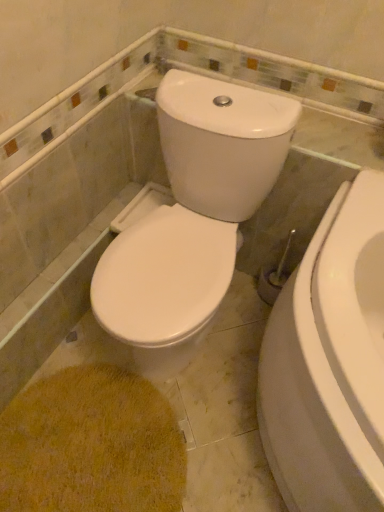
Find the location of a particular element. white glossy toilet at center is located at coordinates (192, 216).

This screenshot has width=384, height=512. Describe the element at coordinates (192, 216) in the screenshot. I see `white glossy toilet at center` at that location.

The height and width of the screenshot is (512, 384). Find the location of `white glossy toilet at center`. white glossy toilet at center is located at coordinates (192, 216).